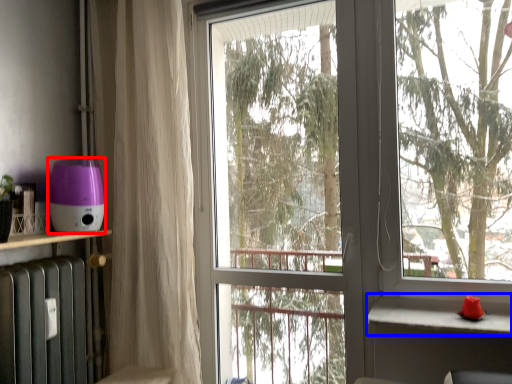
Question: Among these objects, which one is farthest to the camera, appliance (highlighted by a red box) or window sill (highlighted by a blue box)?

Choices:
 (A) appliance
 (B) window sill

Answer: (A)